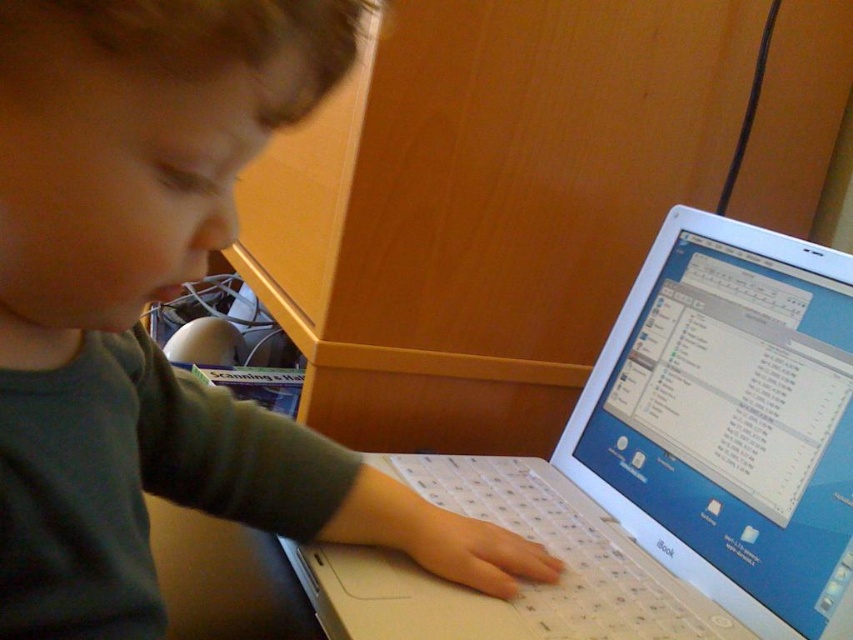
Question: Is gray matte shirt at upper left below white plastic laptop at center?

Choices:
 (A) yes
 (B) no

Answer: (B)

Question: Can you confirm if gray matte shirt at upper left is positioned to the right of white plastic laptop at center?

Choices:
 (A) no
 (B) yes

Answer: (A)

Question: Which of the following is the closest to the observer?

Choices:
 (A) white plastic laptop at center
 (B) gray matte shirt at upper left

Answer: (B)

Question: Is gray matte shirt at upper left below white plastic laptop at center?

Choices:
 (A) yes
 (B) no

Answer: (B)